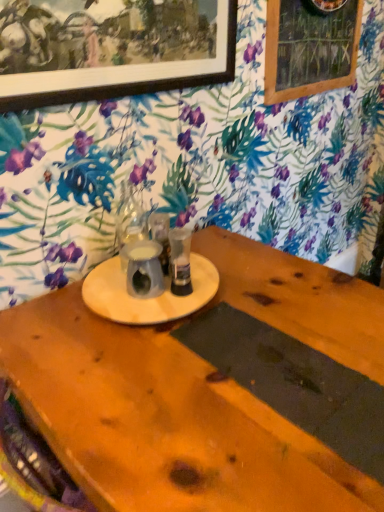
Identify the location of vacant space positioned to the left of metallic silver cup at center, the 1th tableware from the right. (105, 281).